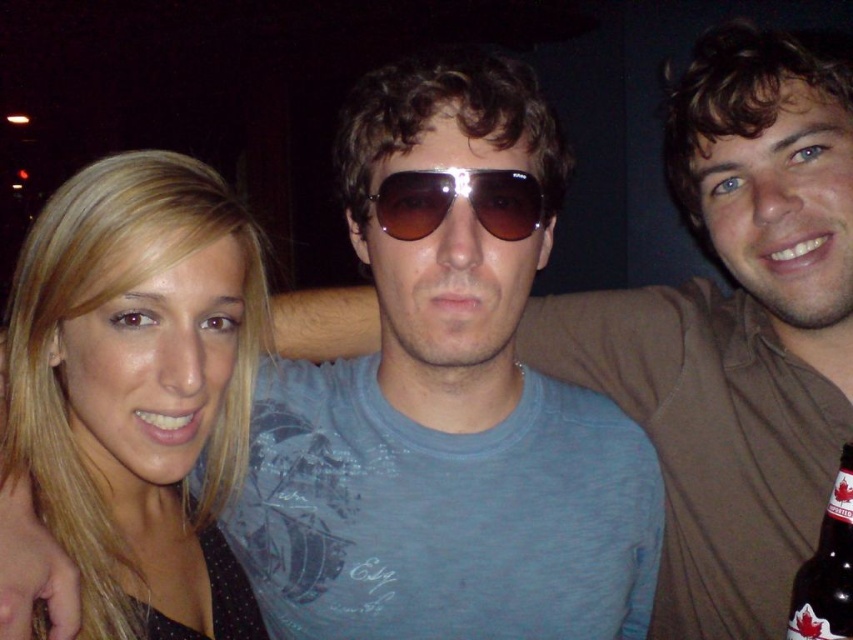
You are standing in front of the group photo and want to place a small sticker exactly at the point labeled as point (791, 529). If your hand can reach up to 1 meter, will you be able to reach that point?

Answer: The distance of point (791, 529) from viewer is 1.04 meters, so your hand cannot reach it since it is slightly beyond the 1 meter limit.

You are a photographer trying to adjust the lighting for a group photo. You have a spotlight that can only illuminate objects to the left of the brown glass bottle at lower right. Will the blonde hair at left be illuminated by this spotlight?

The blonde hair at left is to the left of the brown glass bottle at lower right, so yes, the spotlight will illuminate the blonde hair at left since it is positioned to the left of the bottle.

You are a photographer trying to adjust the lighting for a group photo. You notice the blonde hair at left and the sunglasses at center. Which object requires more careful lighting adjustments to avoid overexposure?

The blonde hair at left requires more careful lighting adjustments because it has a larger size compared to the sunglasses at center, making it more prone to overexposure.